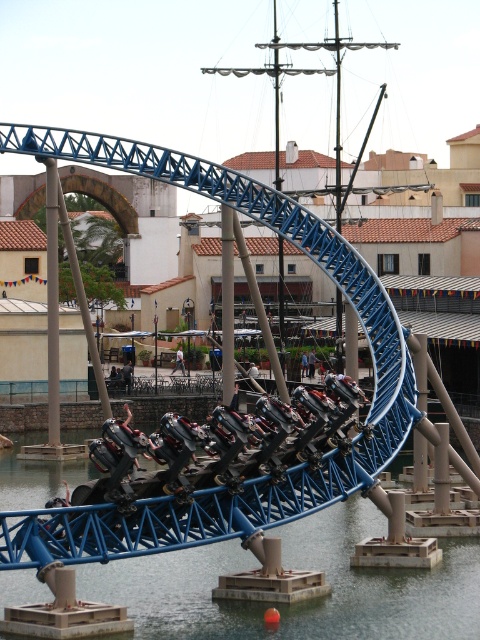
You are standing at the base of the roller coaster and want to reach the point marked at coordinates point (321,624). If your walking speed is 3 feet per second, how many seconds will it take you to reach that point?

The point (321,624) is 247.13 feet away from the viewer. At a walking speed of 3 feet per second, it would take approximately 82.38 seconds to reach that point.

You are a photographer trying to capture a candid shot of the light blue jeans at center and the light brown wooden chair at center. Since you want to focus on the jeans, which object should you avoid placing in the foreground to keep the jeans as the main subject?

The light blue jeans at center is positioned over light brown wooden chair at center. To keep the jeans as the main subject, avoid placing the light brown wooden chair at center in the foreground.